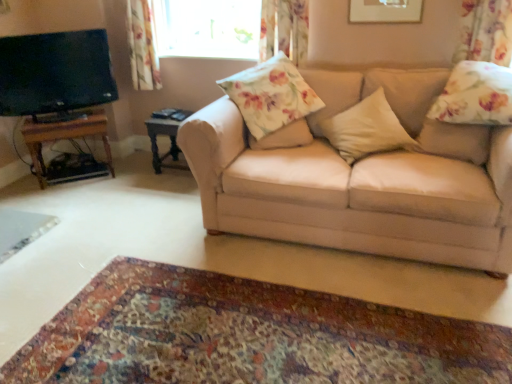
This screenshot has width=512, height=384. I want to click on vacant area on top of floral fabric pillow at center, marked as the first pillow in a left-to-right arrangement (from a real-world perspective), so click(279, 118).